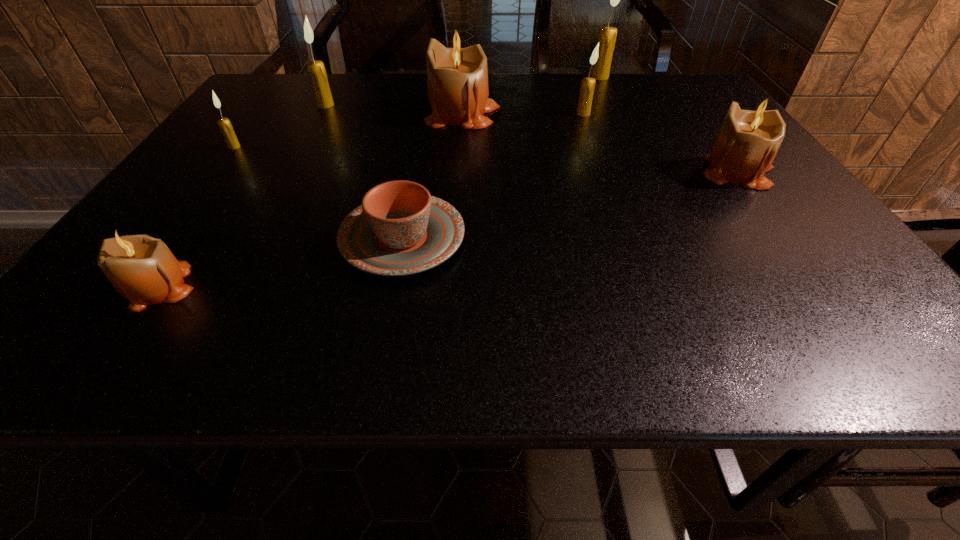
This screenshot has width=960, height=540. Identify the location of the nearest cream candle. (226, 128).

The image size is (960, 540). What are the coordinates of `the fifth farthest candle` in the screenshot? It's located at point(226,128).

At what (x,y) coordinates should I click in order to perform the action: click on the leftmost beige candle. Please return your answer as a coordinate pair (x, y). The height and width of the screenshot is (540, 960). Looking at the image, I should click on (142, 269).

Find the location of `the nearest candle`. the nearest candle is located at coordinates (142, 269).

You are a GUI agent. You are given a task and a screenshot of the screen. Output one action in this format:
    pyautogui.click(x=<x>, y=<y>)
    Task: Click on the chinaware
    The height and width of the screenshot is (540, 960).
    Given the screenshot: What is the action you would take?
    pyautogui.click(x=400, y=229)

The image size is (960, 540). I want to click on pink chinaware, so click(400, 229).

Where is `vacant space located on the front of the farthest cream candle`? vacant space located on the front of the farthest cream candle is located at coordinates (606, 89).

This screenshot has height=540, width=960. Identify the location of vacant space located 0.360m on the front of the sixth object from right to left. (282, 186).

Locate an element on the screen. This screenshot has height=540, width=960. vacant space situated 0.150m on the back of the farthest beige candle is located at coordinates 465,76.

Where is `free location located on the front of the third farthest cream candle`? free location located on the front of the third farthest cream candle is located at coordinates (616, 207).